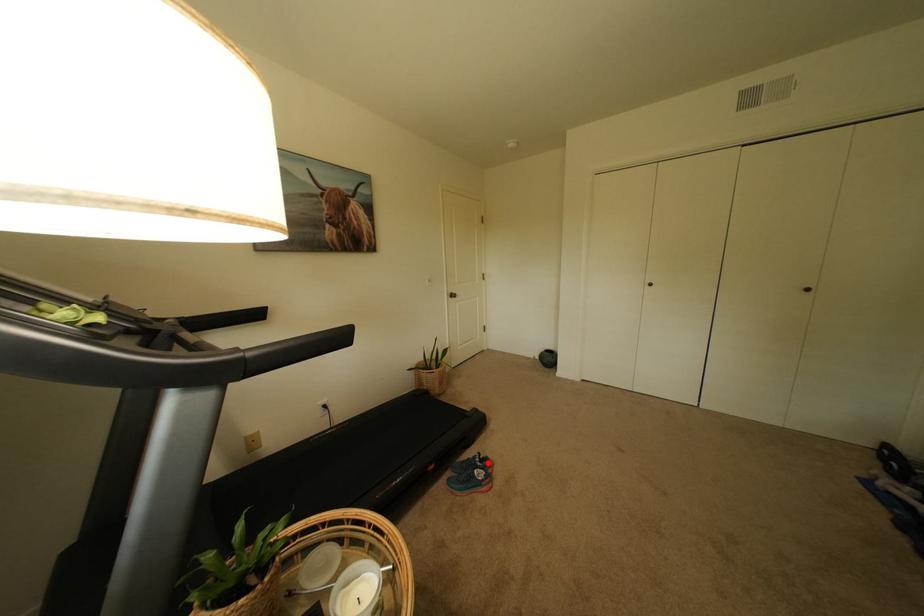
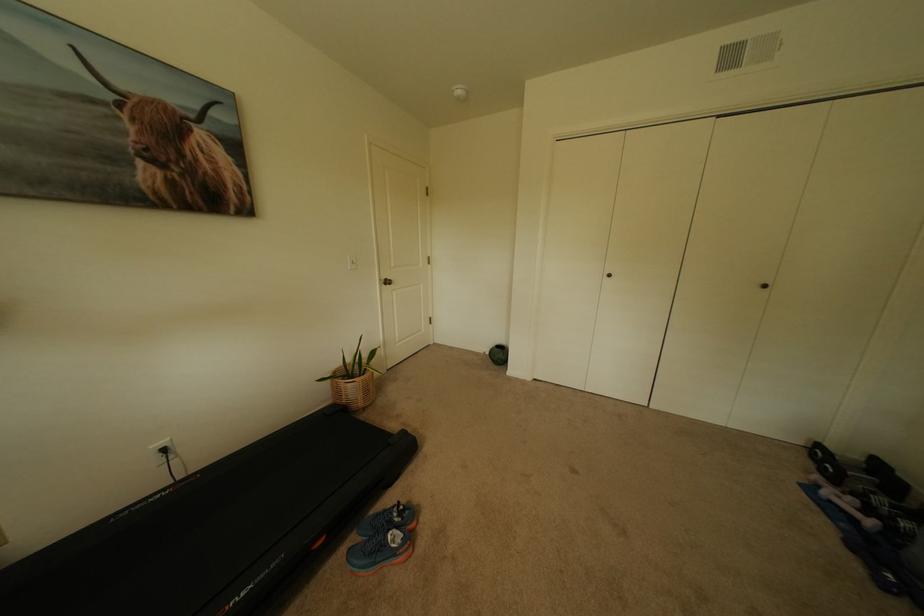
Locate, in the second image, the point that corresponds to the highlighted location in the first image.

(407, 517)